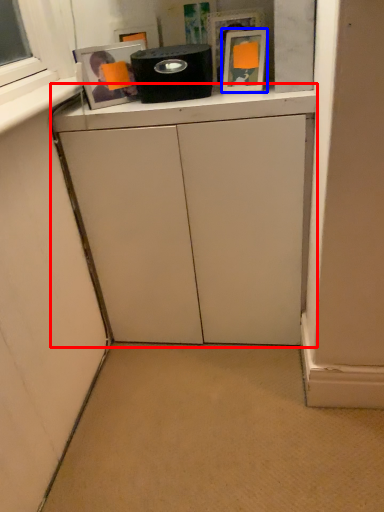
Question: Which object is closer to the camera taking this photo, cabinetry (highlighted by a red box) or picture frame (highlighted by a blue box)?

Choices:
 (A) cabinetry
 (B) picture frame

Answer: (A)